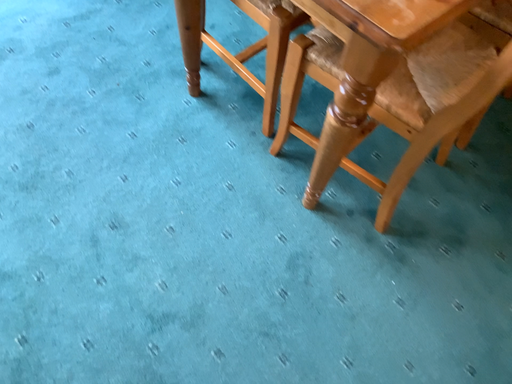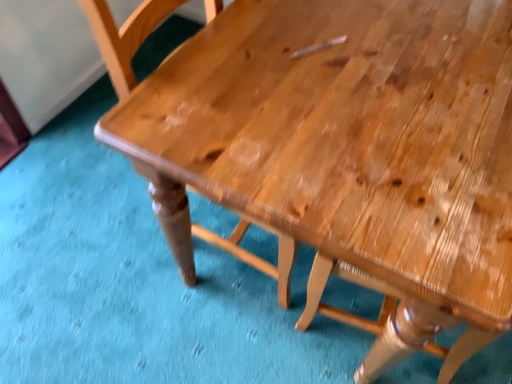
Question: Which way did the camera rotate in the video?

Choices:
 (A) rotated left
 (B) rotated right

Answer: (B)